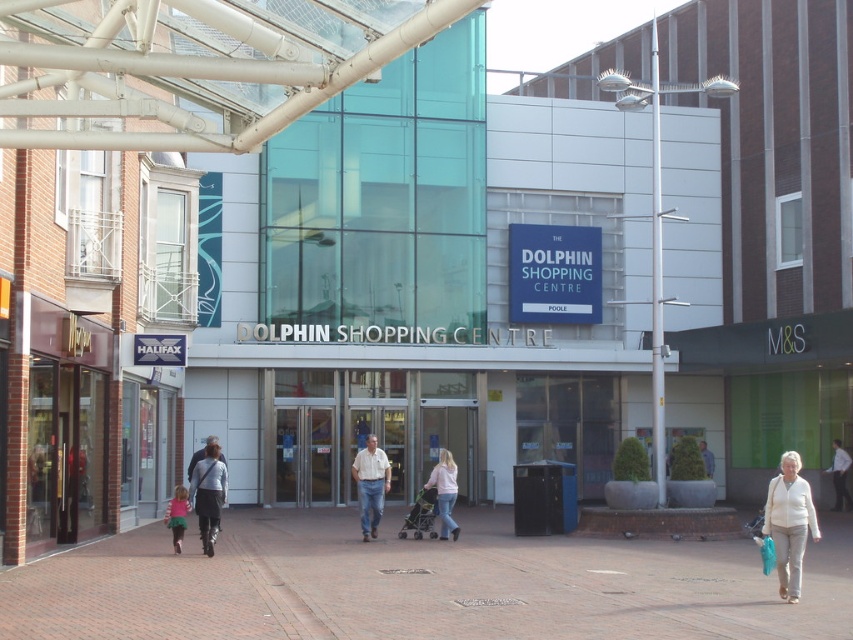
You are standing at the entrance of the Dolphin Shopping Centre and see a light beige shirt at center and a white shirt at center. Which shirt is closer to you?

The light beige shirt at center is 50.81 feet away from the white shirt at center, but the question is about which is closer to you. Since both are at center, their distance from you would depend on their positions relative to each other. However, the description only provides the distance between them, not their individual distances from the entrance. Therefore, we cannot determine which shirt is closer to you based on the given information.